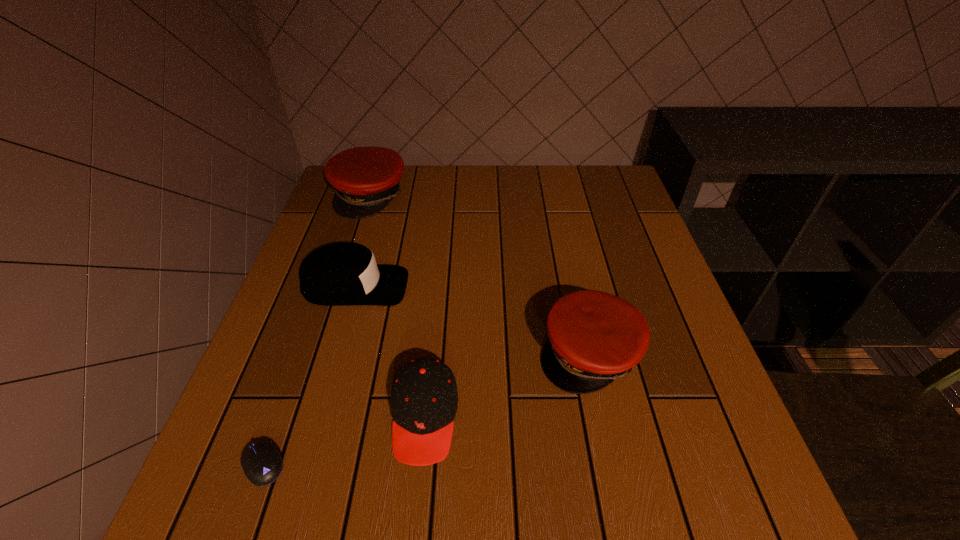
This screenshot has width=960, height=540. I want to click on vacant space that is in between the farthest cap and the rightmost object, so click(x=479, y=274).

Locate an element on the screen. The image size is (960, 540). object that is the nearest to the third cap from left to right is located at coordinates (262, 464).

Identify the location of object that ranks as the second closest to the second farthest cap. (365, 179).

This screenshot has height=540, width=960. In order to click on cap that is the closest one to the rightmost object in this screenshot , I will do `click(424, 398)`.

Identify which cap is the second closest to the rightmost object. Please provide its 2D coordinates. Your answer should be formatted as a tuple, i.e. [(x, y)], where the tuple contains the x and y coordinates of a point satisfying the conditions above.

[(341, 274)]